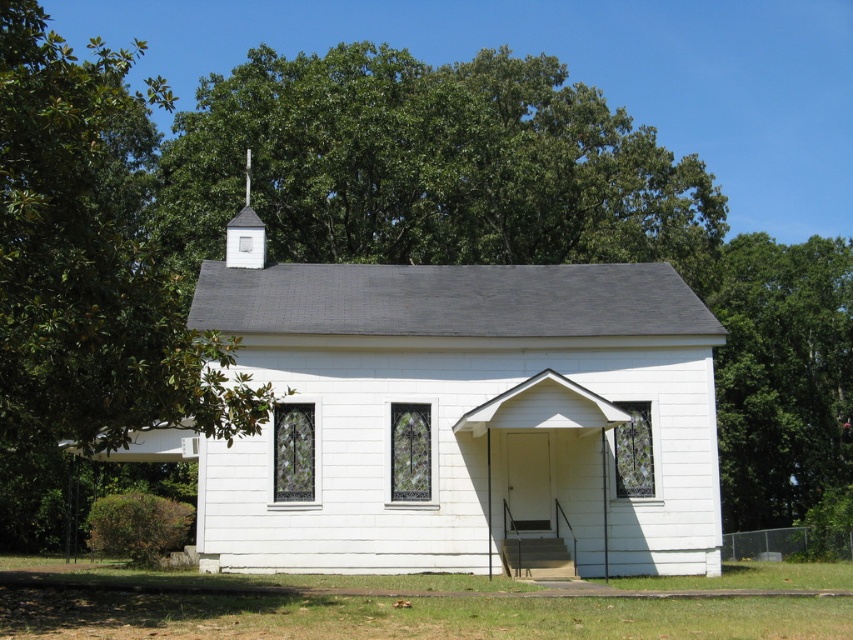
Consider the image. Is white wood chapel at center bigger than green leafy tree at upper right?

Actually, white wood chapel at center might be smaller than green leafy tree at upper right.

Is white wood chapel at center positioned at the back of green leafy tree at upper right?

No, white wood chapel at center is closer to the viewer.

Which is behind, point (503, 396) or point (738, 259)?

Positioned behind is point (738, 259).

What are the coordinates of `white wood chapel at center` in the screenshot? It's located at (461, 417).

Who is taller, green leafy tree at upper left or green leafy tree at upper right?

With more height is green leafy tree at upper left.

Describe the element at coordinates (88, 289) in the screenshot. This screenshot has width=853, height=640. I see `green leafy tree at upper left` at that location.

Who is more distant from viewer, (112, 397) or (723, 371)?

The point (723, 371) is behind.

This screenshot has width=853, height=640. I want to click on green leafy tree at upper left, so click(88, 289).

Between point (280, 477) and point (229, 401), which one is positioned in front?

Point (229, 401) is more forward.

Is white wood chapel at center above green leafy tree at upper left?

No, white wood chapel at center is not above green leafy tree at upper left.

Who is more forward, [328,412] or [86,486]?

Point [328,412] is more forward.

The width and height of the screenshot is (853, 640). Find the location of `white wood chapel at center`. white wood chapel at center is located at coordinates (461, 417).